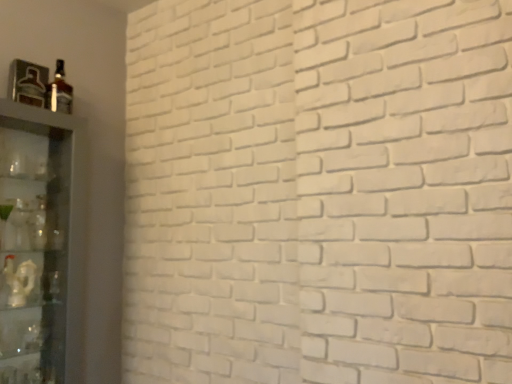
Question: Is clear glass shelf at left taller or shorter than matte glass bottle at upper left, which is the first bottle from right to left?

Choices:
 (A) tall
 (B) short

Answer: (A)

Question: From the image's perspective, relative to matte glass bottle at upper left, which is the first bottle from right to left, is clear glass shelf at left above or below?

Choices:
 (A) below
 (B) above

Answer: (A)

Question: Estimate the real-world distances between objects in this image. Which object is closer to the clear glass shelf at left?

Choices:
 (A) matte glass bottle at upper left, which is the first bottle from right to left
 (B) metallic glass bottle at upper left, placed as the first bottle when sorted from left to right

Answer: (B)

Question: Which object is the farthest from the matte glass bottle at upper left, which is the first bottle from right to left?

Choices:
 (A) metallic glass bottle at upper left, which is counted as the 2th bottle, starting from the right
 (B) clear glass shelf at left

Answer: (B)